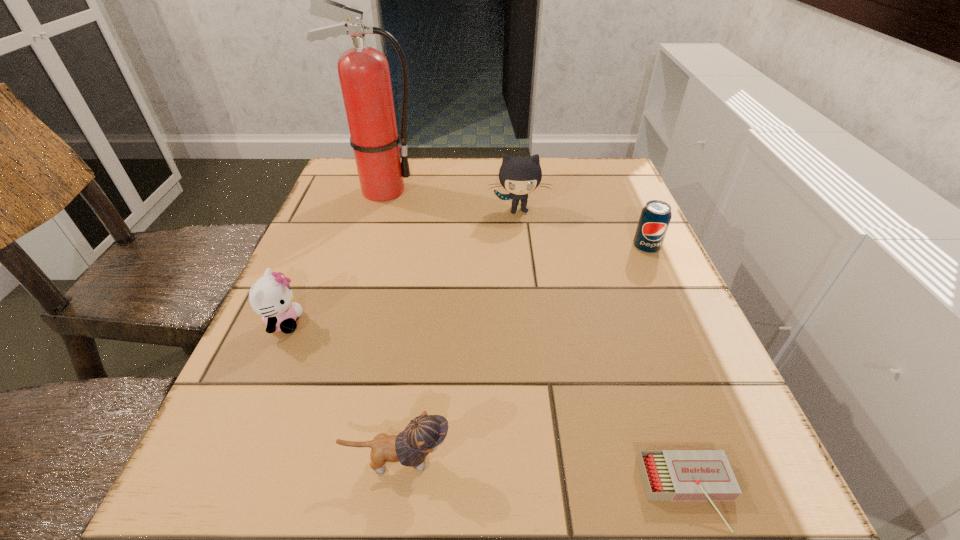
The height and width of the screenshot is (540, 960). I want to click on fire extinguisher, so click(364, 75).

Where is `the second tallest object`? This screenshot has width=960, height=540. the second tallest object is located at coordinates (518, 175).

Where is `the fourth object from left to right`? the fourth object from left to right is located at coordinates (518, 175).

The width and height of the screenshot is (960, 540). I want to click on the leftmost kitten, so click(x=270, y=296).

Locate an element on the screen. This screenshot has width=960, height=540. the fourth farthest object is located at coordinates (270, 296).

This screenshot has height=540, width=960. I want to click on soda can, so click(655, 217).

Locate an element on the screen. the fourth nearest object is located at coordinates (655, 217).

Image resolution: width=960 pixels, height=540 pixels. Find the location of `the nearest kitten`. the nearest kitten is located at coordinates (424, 433).

Find the location of a particular element. the fifth object from left to right is located at coordinates (667, 475).

You are a GUI agent. You are given a task and a screenshot of the screen. Output one action in this format:
    pyautogui.click(x=<x>, y=<y>)
    Task: Click on the shortest object
    Image resolution: width=960 pixels, height=540 pixels.
    Given the screenshot: What is the action you would take?
    pyautogui.click(x=667, y=475)